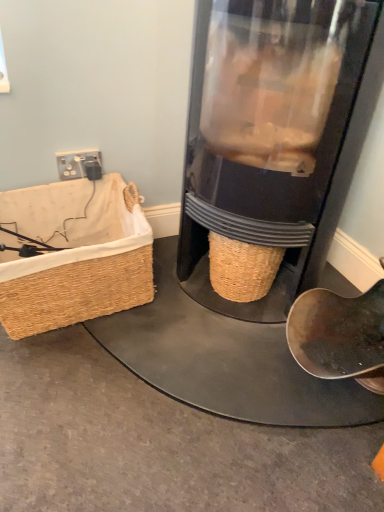
Question: From a real-world perspective, does black plastic plug at upper left stand above woven straw picnic basket at left?

Choices:
 (A) no
 (B) yes

Answer: (B)

Question: Is woven straw picnic basket at left at the back of black plastic plug at upper left?

Choices:
 (A) no
 (B) yes

Answer: (B)

Question: Considering the relative sizes of black plastic plug at upper left and woven straw picnic basket at left in the image provided, is black plastic plug at upper left shorter than woven straw picnic basket at left?

Choices:
 (A) yes
 (B) no

Answer: (A)

Question: From the image's perspective, is black plastic plug at upper left beneath woven straw picnic basket at left?

Choices:
 (A) yes
 (B) no

Answer: (B)

Question: Is woven straw picnic basket at left completely or partially inside black plastic plug at upper left?

Choices:
 (A) yes
 (B) no

Answer: (B)

Question: Considering the relative sizes of black plastic plug at upper left and woven straw picnic basket at left in the image provided, is black plastic plug at upper left taller than woven straw picnic basket at left?

Choices:
 (A) no
 (B) yes

Answer: (A)

Question: Does woven straw picnic basket at left have a lesser height compared to black plastic plug at upper left?

Choices:
 (A) no
 (B) yes

Answer: (A)

Question: Is woven straw picnic basket at left outside black plastic plug at upper left?

Choices:
 (A) no
 (B) yes

Answer: (B)

Question: From a real-world perspective, is woven straw picnic basket at left over black plastic plug at upper left?

Choices:
 (A) no
 (B) yes

Answer: (A)

Question: From a real-world perspective, does woven straw picnic basket at left sit lower than black plastic plug at upper left?

Choices:
 (A) no
 (B) yes

Answer: (B)

Question: Is woven straw picnic basket at left bigger than black plastic plug at upper left?

Choices:
 (A) no
 (B) yes

Answer: (B)

Question: From the image's perspective, is woven straw picnic basket at left above black plastic plug at upper left?

Choices:
 (A) no
 (B) yes

Answer: (A)

Question: Does woven straw picnic basket at left come in front of transparent plastic coffee grinder at center?

Choices:
 (A) no
 (B) yes

Answer: (A)